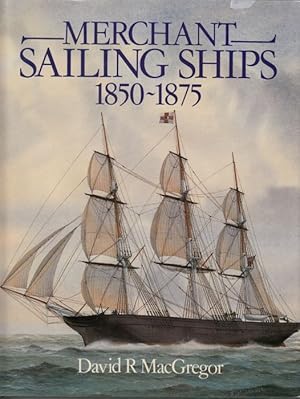
Where is `cables`? cables is located at coordinates (62, 201), (69, 162), (137, 158), (224, 167).